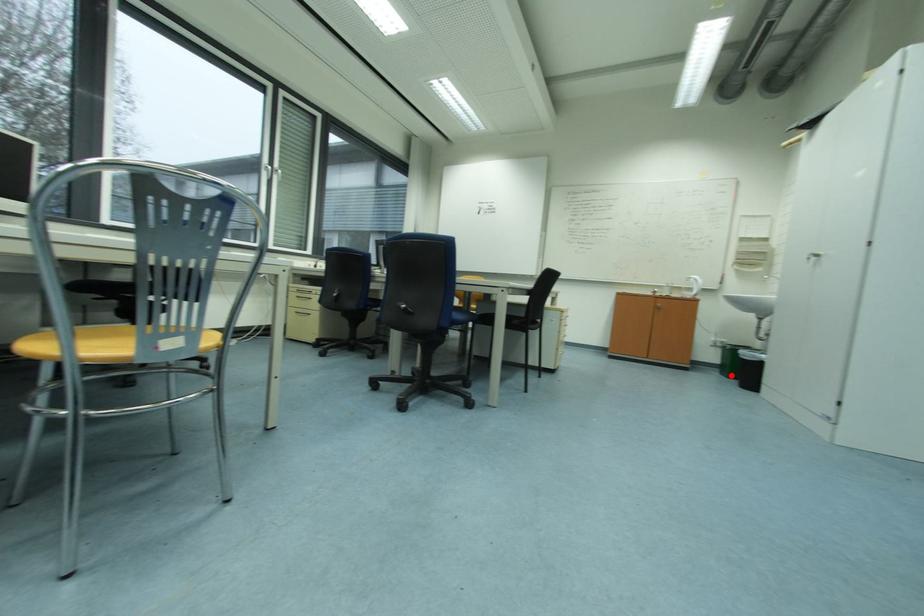
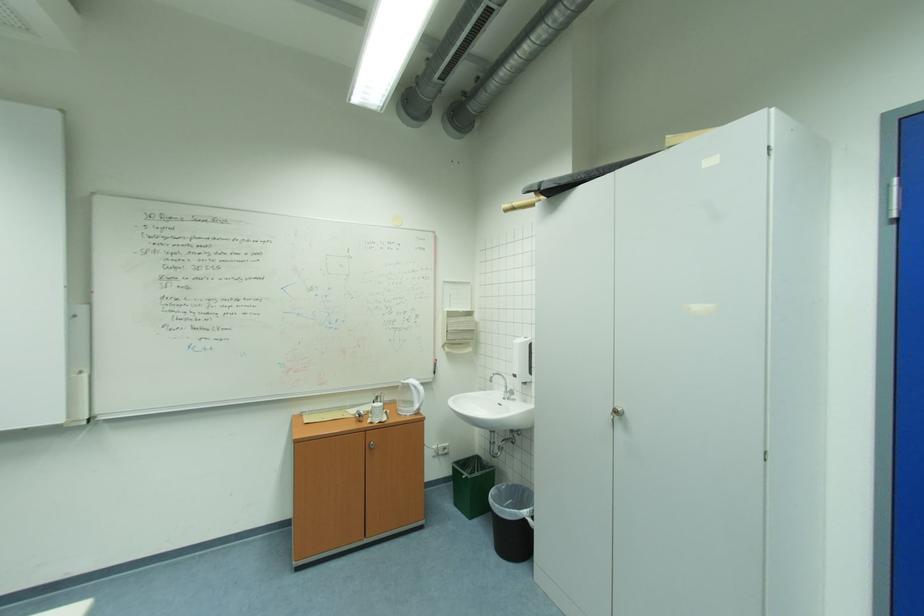
Find the pixel in the second image that matches the highlighted location in the first image.

(464, 505)